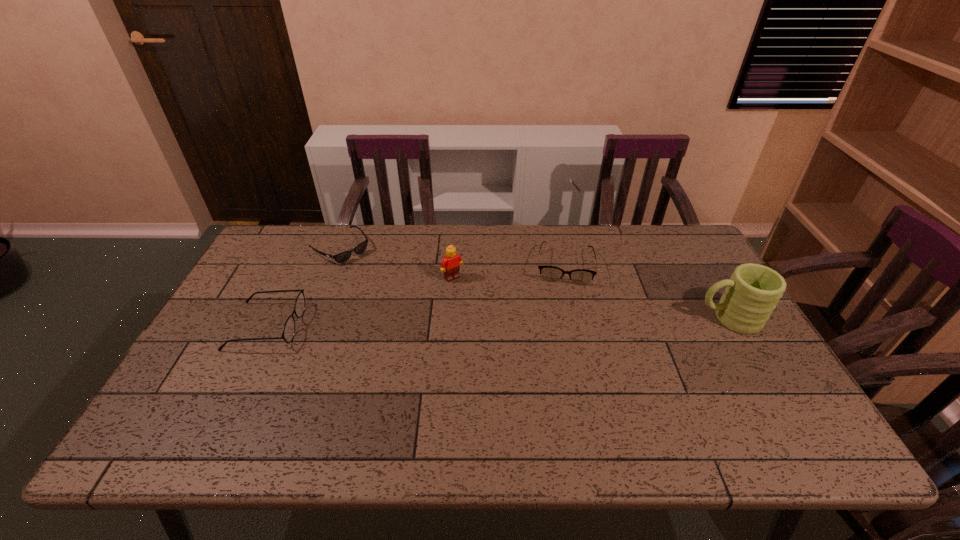
Locate an element on the screen. The width and height of the screenshot is (960, 540). free spot located on the front-facing side of the shortest object is located at coordinates (428, 320).

In order to click on spectacles that is at the far edge in this screenshot , I will do `click(548, 273)`.

Find the location of a particular element. sunglasses that is at the far edge is located at coordinates (342, 257).

Find the location of a particular element. object at the left edge is located at coordinates (288, 332).

I want to click on object situated at the right edge, so click(751, 294).

Where is `vacant space at the far edge of the desktop`? The width and height of the screenshot is (960, 540). vacant space at the far edge of the desktop is located at coordinates (504, 247).

Locate an element on the screen. The width and height of the screenshot is (960, 540). free space at the near edge of the desktop is located at coordinates (395, 411).

Image resolution: width=960 pixels, height=540 pixels. In order to click on vacant region at the left edge of the desktop in this screenshot , I will do `click(259, 351)`.

This screenshot has height=540, width=960. I want to click on free space at the right edge of the desktop, so click(x=723, y=352).

At what (x,y) coordinates should I click in order to perform the action: click on free spot at the far left corner of the desktop. Please return your answer as a coordinate pair (x, y). This screenshot has width=960, height=540. Looking at the image, I should click on (262, 247).